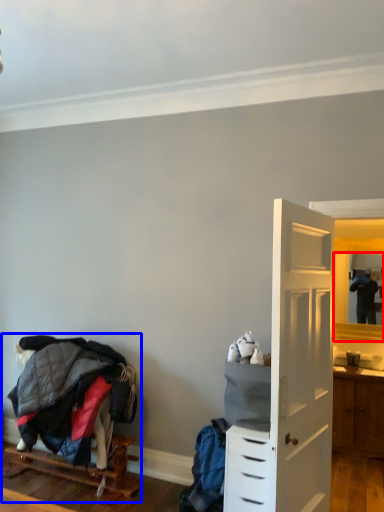
Question: Which of the following is the farthest to the observer, mirror (highlighted by a red box) or bunk bed (highlighted by a blue box)?

Choices:
 (A) mirror
 (B) bunk bed

Answer: (A)